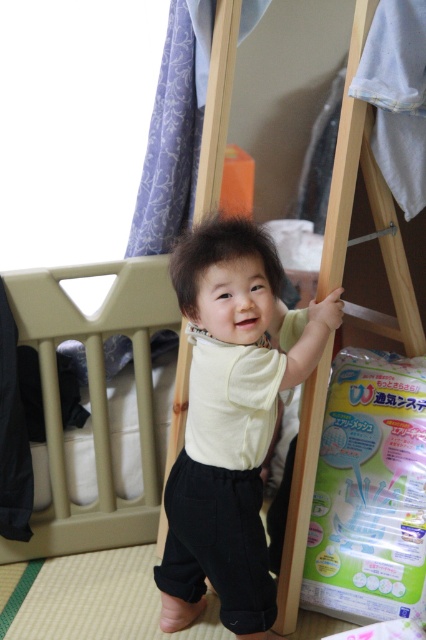
In the scene shown: Is beige plastic crib at left positioned before wooden easel at center?

That is False.

Based on the photo, which is below, beige plastic crib at left or wooden easel at center?

wooden easel at center is lower down.

The image size is (426, 640). Find the location of `beige plastic crib at left`. beige plastic crib at left is located at coordinates (92, 397).

Between point (253, 296) and point (310, 490), which one is positioned in front?

Point (253, 296) is more forward.

Locate an element on the screen. Image resolution: width=426 pixels, height=640 pixels. matte yellow shirt at center is located at coordinates (253, 428).

Who is shorter, matte yellow shirt at center or beige plastic crib at left?

With less height is beige plastic crib at left.

Does matte yellow shirt at center have a lesser width compared to beige plastic crib at left?

Correct, matte yellow shirt at center's width is less than beige plastic crib at left's.

Who is more distant from viewer, [238,333] or [20,304]?

Positioned behind is point [20,304].

Image resolution: width=426 pixels, height=640 pixels. What are the coordinates of `matte yellow shirt at center` in the screenshot? It's located at (253, 428).